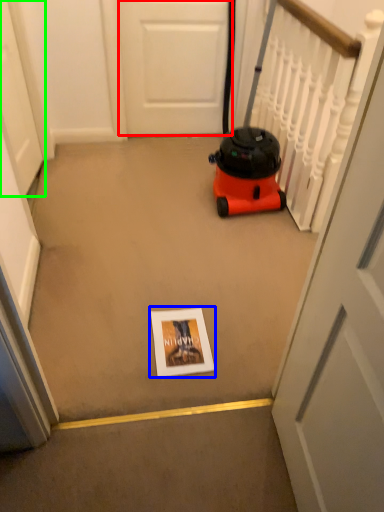
Question: Which object is the closest to the door (highlighted by a red box)? Choose among these: copy (highlighted by a blue box) or door (highlighted by a green box).

Choices:
 (A) copy
 (B) door

Answer: (B)